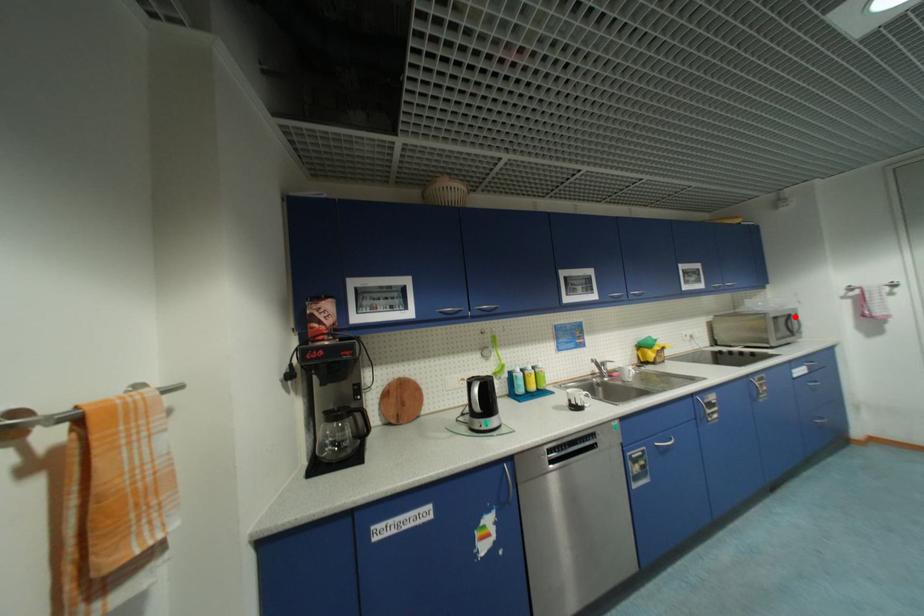
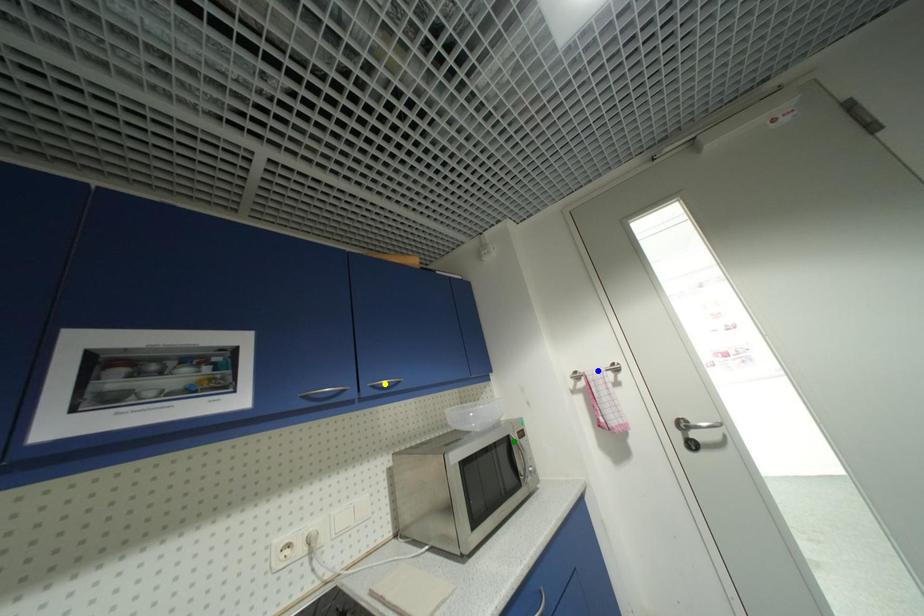
Question: I am providing you with two images of the same scene from different viewpoints. A red point is marked on the first image. You are given multiple points on the second image. Can you choose the point in image 2 that corresponds to the point in image 1?

Choices:
 (A) green point
 (B) blue point
 (C) yellow point

Answer: (A)